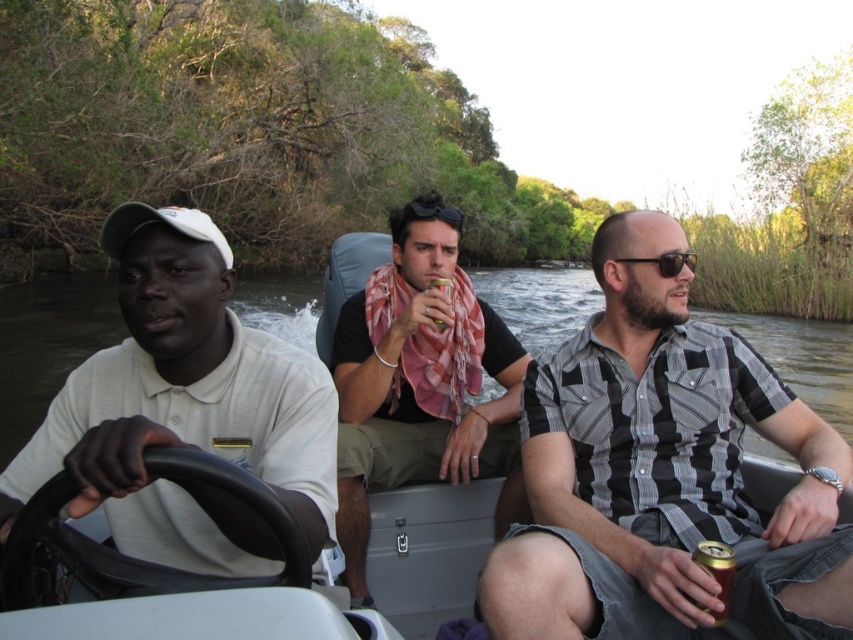
Based on the scene description, where is the smooth plastic boat at center located in terms of its 2D coordinates?

The smooth plastic boat at center is located at the 2D coordinates of point (428,552).

You are a drone operator trying to capture a photo of the smooth plastic boat at center and sunglasses at center from above. What is the minimum distance your drone needs to fly to ensure both objects are in frame?

The smooth plastic boat at center and sunglasses at center are 23.96 meters apart, so the drone needs to fly at least 23.96 meters away to capture both in the frame.